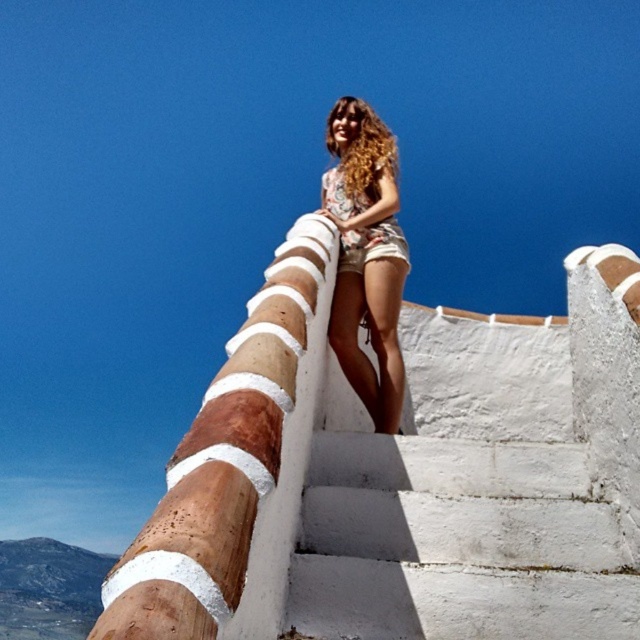
You are a photographer trying to capture the perfect shot of the person on the white stone wall. You want to ensure that both the floral fabric shorts at center and the curly blonde hair at upper center are visible in the frame. Based on their sizes, which of these two items should you focus on to ensure they are both fully captured in your photo?

The floral fabric shorts at center has a larger width than the curly blonde hair at upper center, so focusing on the floral fabric shorts at center would ensure both items are fully visible in the frame.

You are a photographer trying to capture the perfect shot of the person on the white stone wall. You notice the white painted concrete stairs at center and the curly blonde hair at upper center in your frame. Which object occupies more vertical space in the image?

The curly blonde hair at upper center occupies more vertical space in the image than the white painted concrete stairs at center, as it is taller.

You are a photographer trying to capture a photo of the curly blonde hair at upper center and the white painted concrete stairs at center. Which object should you focus on first if you want to ensure both are in focus?

The white painted concrete stairs at center is below curly blonde hair at upper center, so you should focus on the curly blonde hair at upper center first to ensure both are in focus.